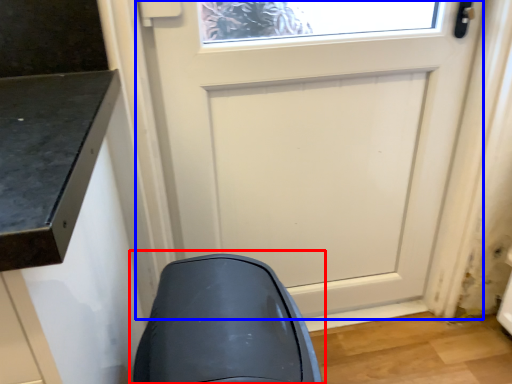
Question: Among these objects, which one is farthest to the camera, swivel chair (highlighted by a red box) or door (highlighted by a blue box)?

Choices:
 (A) swivel chair
 (B) door

Answer: (B)